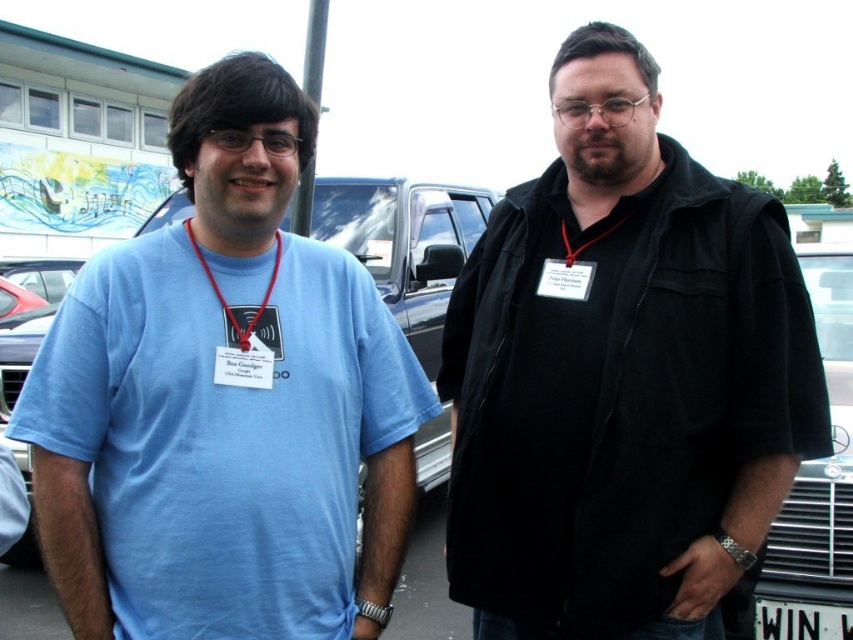
You are a photographer taking a picture of the two people in the parking lot. You notice the matte blue shirt at center and the red leather lanyard at center. Which object should you focus on if you want to capture the one that is higher in the frame?

The matte blue shirt at center is above the red leather lanyard at center, so you should focus on the matte blue shirt at center to capture the higher object in the frame.

You are a delivery person who needs to place a package between the black fabric at center and the white plastic license plate at lower right. The package is 6 feet long. Can you fit the package between them without bending it?

The distance between the black fabric at center and the white plastic license plate at lower right is 6.28 feet. Since the package is 6 feet long, it can fit between them without bending.